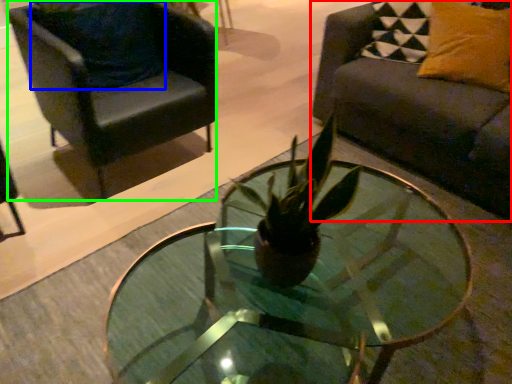
Question: Which object is the closest to the studio couch (highlighted by a red box)? Choose among these: pillow (highlighted by a blue box) or chair (highlighted by a green box).

Choices:
 (A) pillow
 (B) chair

Answer: (B)